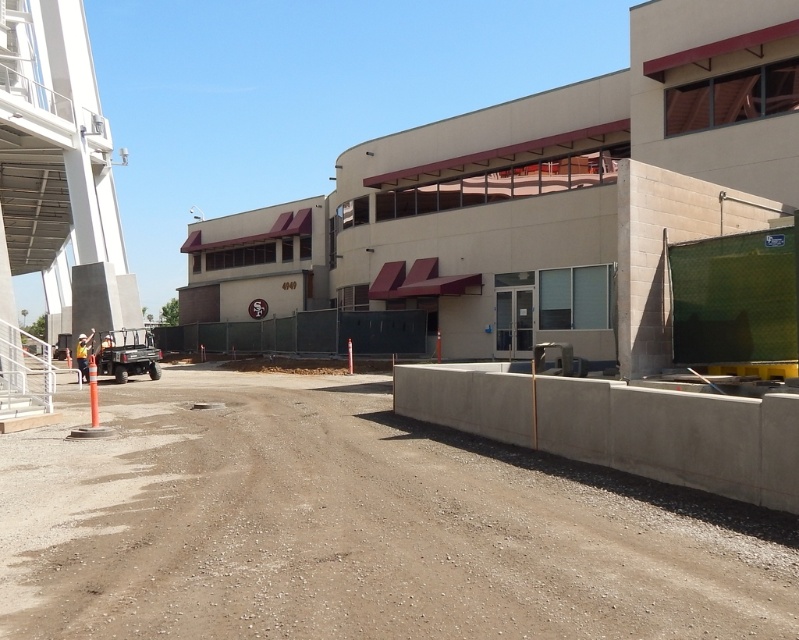
You are a delivery truck driver arriving at a construction site. You need to park your truck on the dirt track at lower left or the concrete wall at lower right. Which location has more space for parking your truck?

The concrete wall at lower right has more space for parking your truck because it occupies more area than the dirt track at lower left.

You are a delivery truck driver approaching the construction site. You need to determine if your truck can safely pass over the dirt track at lower left and the concrete wall at lower right. Based on their heights, which one might pose a clearance issue for your truck?

The concrete wall at lower right is taller than the dirt track at lower left. Since the dirt track at lower left has a lesser height, it would not pose a clearance issue. However, the concrete wall at lower right is taller, so it might be a problem if your truck exceeds its height.

You are a delivery truck driver approaching the construction site. You need to reach the entrance of the building which is behind the black matte barrier at center. Can you drive your truck over the dirt track at lower left to get there?

The dirt track at lower left is located below the black matte barrier at center, so driving over the dirt track at lower left might allow you to reach the entrance behind the barrier. However, the barrier may block direct access, requiring a detour around it.